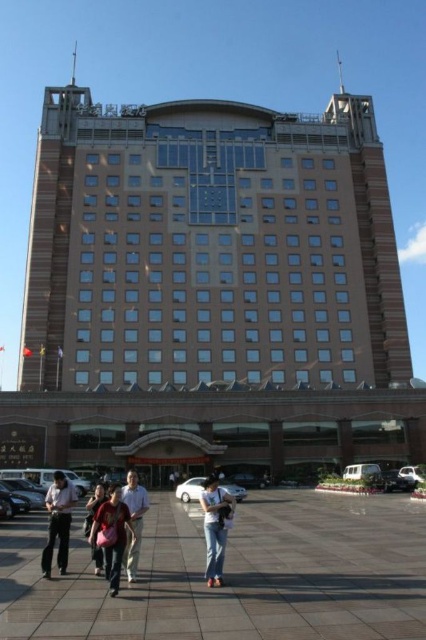
Where is the matte pink jacket at center located in the image?

The matte pink jacket at center is located at point (111, 536).

Based on the photo, you are standing in front of the building and see the brown tile pavement at lower center and the light brown leather jacket at lower left. Which object is closer to the ground?

The brown tile pavement at lower center is located below the light brown leather jacket at lower left, so it is closer to the ground.

From the picture: You are standing in the plaza in front of the building and see two people wearing a light beige shirt at center and a light brown leather jacket at lower center. Which person is standing closer to the building?

The light brown leather jacket at lower center is closer to the building because the light beige shirt at center is positioned over it, indicating it is in front.